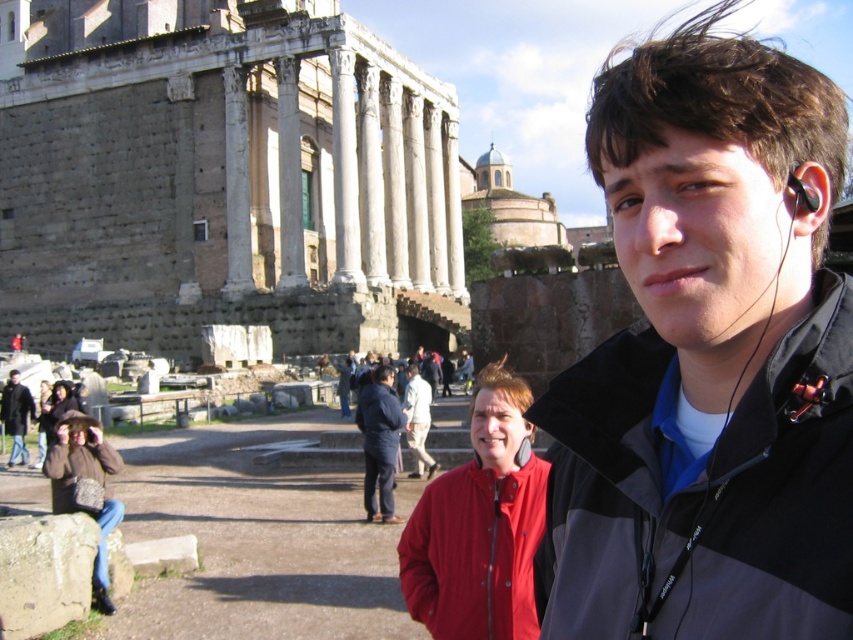
Question: Which object is closer to the camera taking this photo?

Choices:
 (A) gray stone temple at center
 (B) matte red jacket at center

Answer: (B)

Question: Is brown textured jacket at lower left positioned in front of dark brown leather jacket at lower left?

Choices:
 (A) yes
 (B) no

Answer: (A)

Question: Does gray stone temple at center appear over matte red jacket at center?

Choices:
 (A) yes
 (B) no

Answer: (A)

Question: Can you confirm if dark blue jacket at center is bigger than light beige fabric jacket at center?

Choices:
 (A) yes
 (B) no

Answer: (A)

Question: Which is nearer to the brown textured jacket at lower left?

Choices:
 (A) light beige fabric jacket at center
 (B) matte red jacket at center
 (C) dark blue jacket at center
 (D) dark brown leather jacket at lower left

Answer: (C)

Question: Which point is farther from the camera taking this photo?

Choices:
 (A) coord(32,44)
 (B) coord(83,445)
 (C) coord(799,202)

Answer: (A)